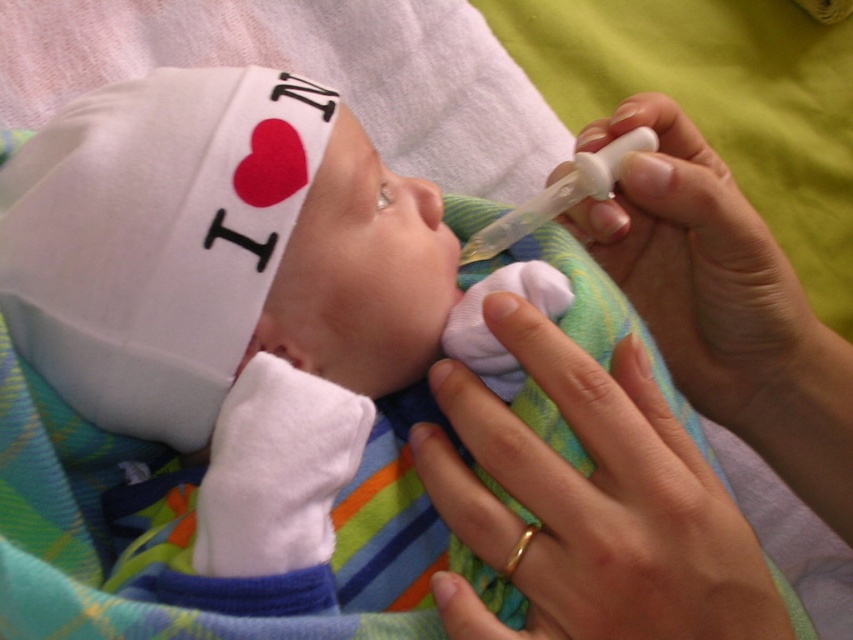
Question: Estimate the real-world distances between objects in this image. Which object is closer to the gold ring at lower center?

Choices:
 (A) smooth skin nose at center
 (B) gold metallic teething ring at lower center
 (C) white plastic syringe at upper right

Answer: (B)

Question: Can you confirm if white soft fabric baby at center is positioned below white plastic syringe at upper right?

Choices:
 (A) yes
 (B) no

Answer: (A)

Question: Is the position of gold ring at lower center more distant than that of white matte syringe at upper right?

Choices:
 (A) no
 (B) yes

Answer: (A)

Question: Among these objects, which one is farthest from the camera?

Choices:
 (A) smooth skin nose at center
 (B) white matte syringe at upper right
 (C) white soft fabric baby at center
 (D) white plastic syringe at upper right

Answer: (D)

Question: Which of these objects is positioned farthest from the white plastic syringe at upper right?

Choices:
 (A) smooth skin nose at center
 (B) gold ring at lower center

Answer: (B)

Question: Does white matte syringe at upper right appear under smooth skin nose at center?

Choices:
 (A) no
 (B) yes

Answer: (B)